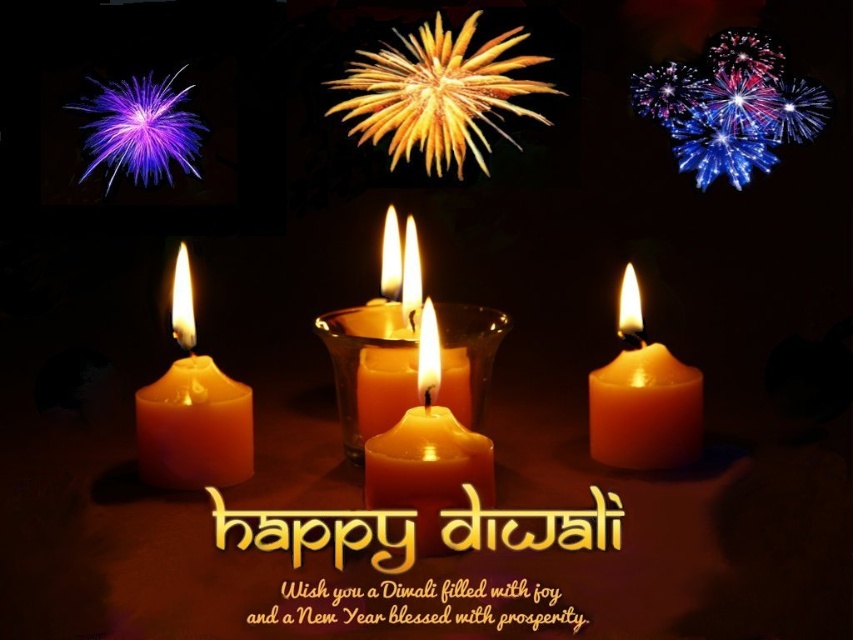
Consider the image. Between sparkling glass fireworks at upper right and matte orange candle at center, which one has less height?

With less height is matte orange candle at center.

Does sparkling glass fireworks at upper right lie behind matte orange candle at center?

That is True.

Does point (712, 70) lie in front of point (463, 442)?

No, (712, 70) is behind (463, 442).

The width and height of the screenshot is (853, 640). I want to click on sparkling glass fireworks at upper right, so click(x=730, y=106).

Is matte orange candle at lower left smaller than matte orange candle at lower right?

Actually, matte orange candle at lower left might be larger than matte orange candle at lower right.

Based on the photo, is the position of matte orange candle at lower left more distant than that of matte orange candle at lower right?

No, matte orange candle at lower left is in front of matte orange candle at lower right.

The height and width of the screenshot is (640, 853). I want to click on matte orange candle at lower left, so click(x=192, y=410).

Where is `matte orange candle at lower left`? matte orange candle at lower left is located at coordinates (192, 410).

What do you see at coordinates (730, 106) in the screenshot? The image size is (853, 640). I see `sparkling glass fireworks at upper right` at bounding box center [730, 106].

Consider the image. Is sparkling glass fireworks at upper right positioned in front of matte orange candle at lower left?

No, it is not.

The width and height of the screenshot is (853, 640). I want to click on sparkling glass fireworks at upper right, so click(x=730, y=106).